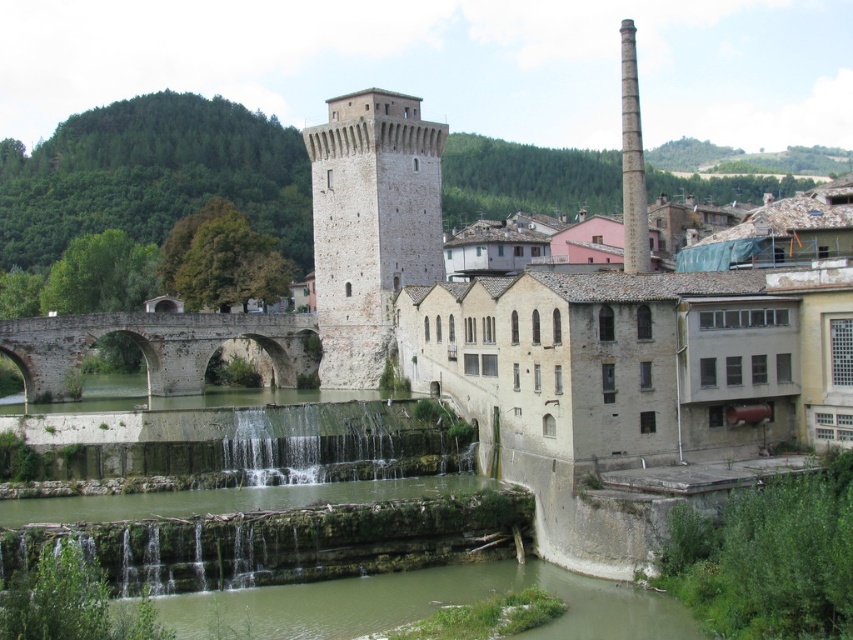
Question: Estimate the real-world distances between objects in this image. Which object is closer to the smooth gray chimney at upper center?

Choices:
 (A) gray stone chimney at upper right
 (B) brown stone bridge at lower left

Answer: (B)

Question: Which object is closer to the camera taking this photo?

Choices:
 (A) brown stone bridge at lower left
 (B) smooth gray chimney at upper center
 (C) gray stone chimney at upper right

Answer: (C)

Question: Where is brown stone bridge at lower left located in relation to gray stone chimney at upper right in the image?

Choices:
 (A) left
 (B) right

Answer: (A)

Question: Considering the real-world distances, which object is closest to the brown stone bridge at lower left?

Choices:
 (A) smooth gray chimney at upper center
 (B) gray stone chimney at upper right

Answer: (A)

Question: Can you confirm if smooth gray chimney at upper center is positioned below brown stone bridge at lower left?

Choices:
 (A) no
 (B) yes

Answer: (A)

Question: Is brown stone bridge at lower left to the left of gray stone chimney at upper right from the viewer's perspective?

Choices:
 (A) yes
 (B) no

Answer: (A)